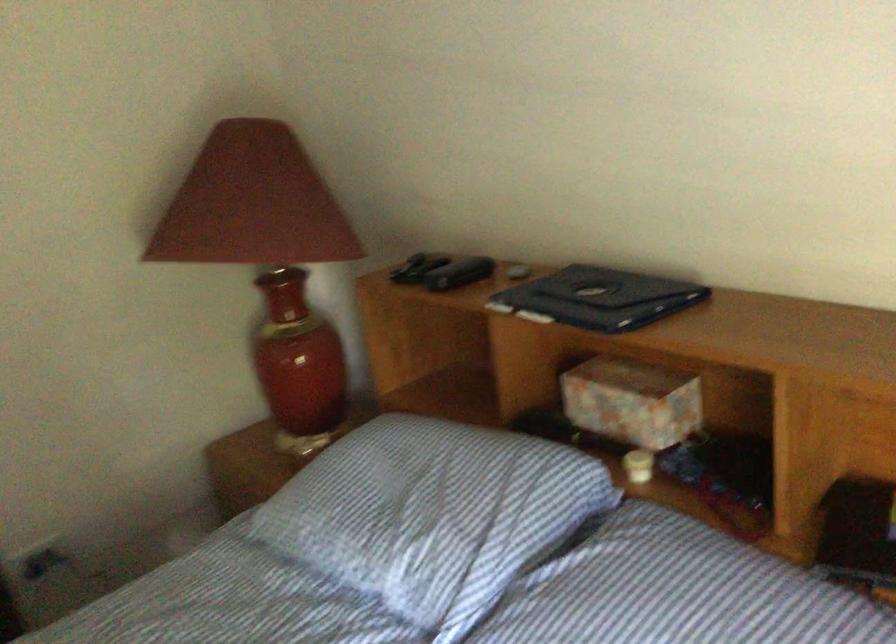
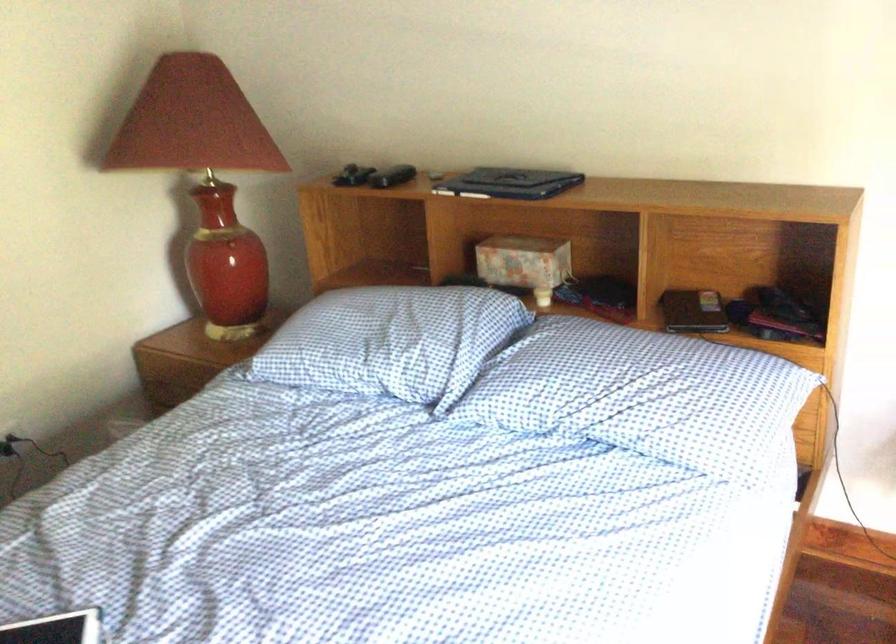
The point at (590, 303) is marked in the first image. Where is the corresponding point in the second image?

(510, 183)